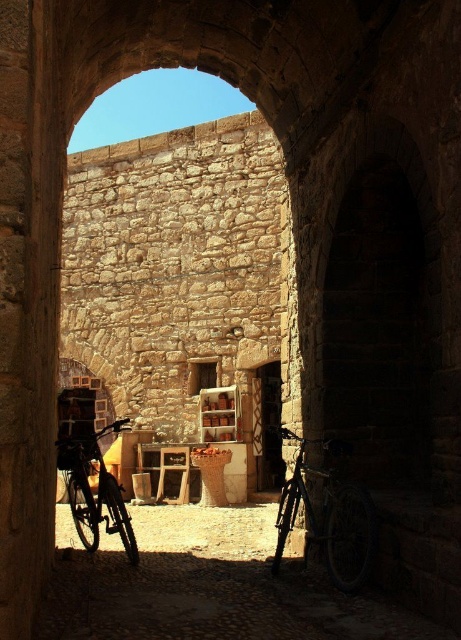
Question: Which point is farther to the camera?

Choices:
 (A) shiny black bicycle at left
 (B) shiny metallic bicycle at center
 (C) metallic bicycle at center

Answer: (A)

Question: Which object is positioned closest to the shiny metallic bicycle at center?

Choices:
 (A) shiny black bicycle at left
 (B) metallic bicycle at center

Answer: (B)

Question: Can you confirm if shiny metallic bicycle at center is wider than shiny black bicycle at left?

Choices:
 (A) no
 (B) yes

Answer: (A)

Question: Which of these objects is positioned closest to the metallic bicycle at center?

Choices:
 (A) shiny metallic bicycle at center
 (B) shiny black bicycle at left

Answer: (A)

Question: Is shiny metallic bicycle at center bigger than shiny black bicycle at left?

Choices:
 (A) yes
 (B) no

Answer: (B)

Question: Does metallic bicycle at center appear on the right side of shiny black bicycle at left?

Choices:
 (A) yes
 (B) no

Answer: (A)